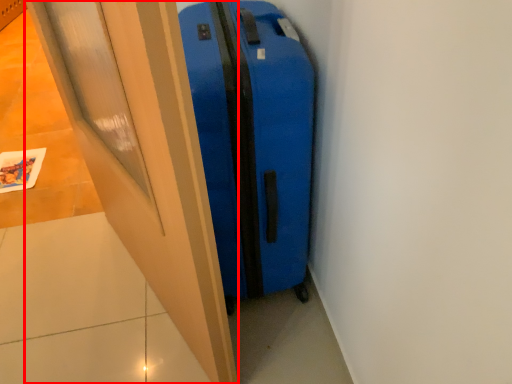
Question: From the image's perspective, considering the relative positions of door (annotated by the red box) and suitcase in the image provided, where is door (annotated by the red box) located with respect to the staircase?

Choices:
 (A) below
 (B) above

Answer: (A)